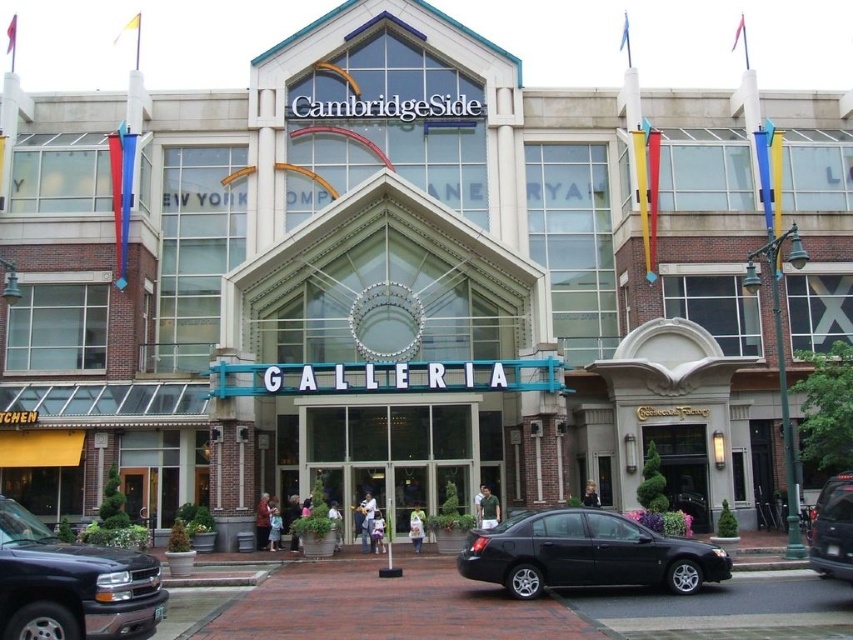
Is matte black truck at lower left above metallic gray suv at center?

Yes.

Who is more distant from viewer, (78, 563) or (833, 532)?

Point (833, 532)

What do you see at coordinates (73, 584) in the screenshot? I see `matte black truck at lower left` at bounding box center [73, 584].

I want to click on matte black truck at lower left, so click(73, 584).

Does black matte sedan at center have a lesser height compared to black wooden door at center?

Indeed, black matte sedan at center has a lesser height compared to black wooden door at center.

Is point (599, 586) farther from camera compared to point (674, 472)?

No, it is in front of (674, 472).

Locate an element on the screen. black matte sedan at center is located at coordinates (585, 554).

The height and width of the screenshot is (640, 853). I want to click on black matte sedan at center, so click(585, 554).

Can you confirm if matte black truck at lower left is positioned above black wooden door at center?

Yes.

At what (x,y) coordinates should I click in order to perform the action: click on matte black truck at lower left. Please return your answer as a coordinate pair (x, y). Image resolution: width=853 pixels, height=640 pixels. Looking at the image, I should click on (73, 584).